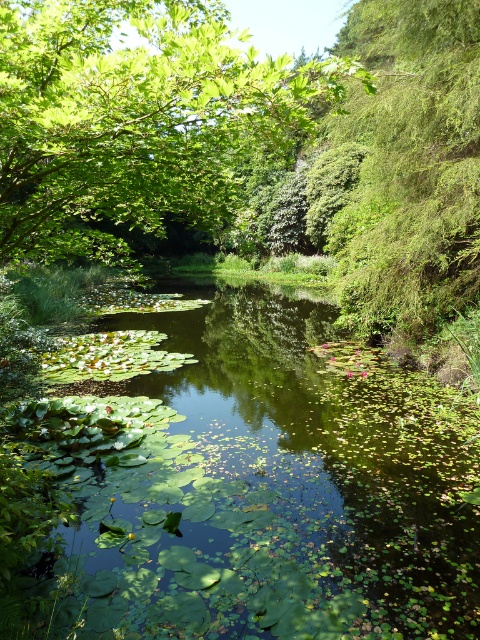
Question: Among these objects, which one is nearest to the camera?

Choices:
 (A) green leafy river at center
 (B) green leafy tree at upper left
 (C) green fuzzy bush at right

Answer: (B)

Question: Which point is closer to the camera?

Choices:
 (A) green leafy river at center
 (B) green leafy tree at upper left

Answer: (B)

Question: Can you confirm if green leafy river at center is positioned above green leafy tree at upper left?

Choices:
 (A) no
 (B) yes

Answer: (A)

Question: Which object is closer to the camera taking this photo?

Choices:
 (A) green fuzzy bush at right
 (B) green leafy river at center
 (C) green leafy tree at upper left

Answer: (C)

Question: Can you confirm if green leafy river at center is smaller than green fuzzy bush at right?

Choices:
 (A) yes
 (B) no

Answer: (A)

Question: Is green leafy river at center to the left of green fuzzy bush at right from the viewer's perspective?

Choices:
 (A) yes
 (B) no

Answer: (A)